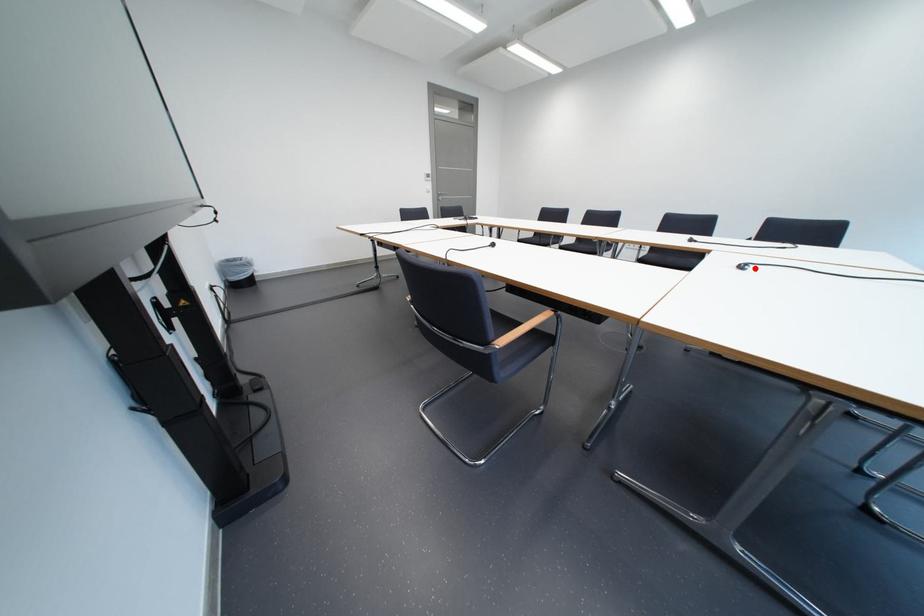
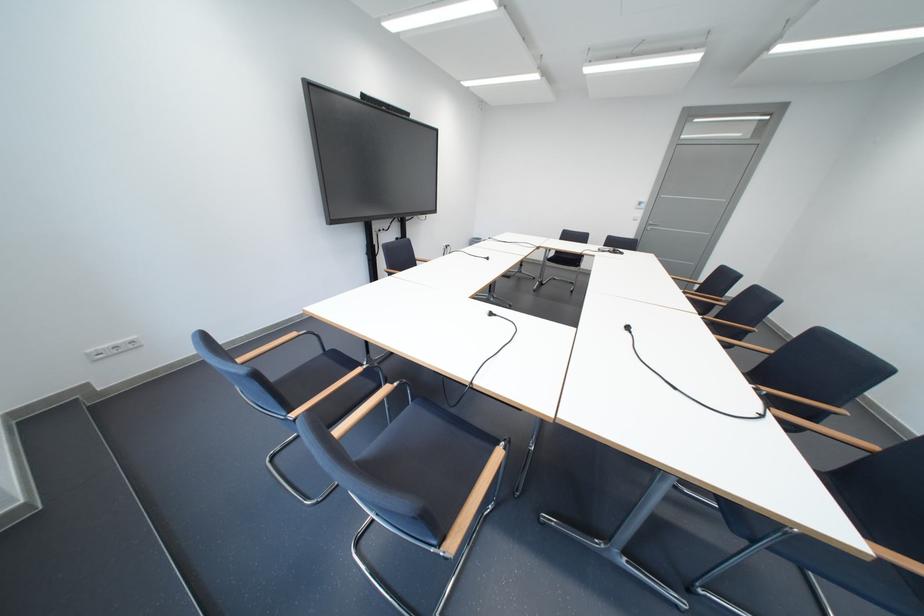
Locate, in the second image, the point that corresponds to the highlighted location in the first image.

(503, 315)